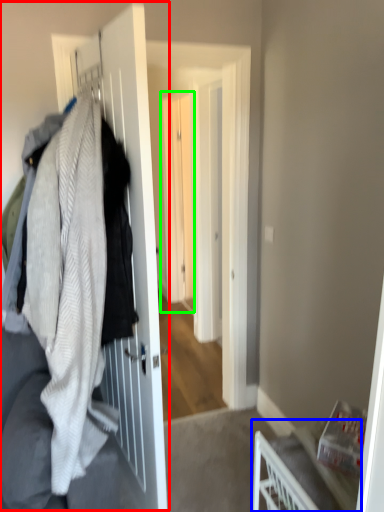
Question: Which is farther away from closet (highlighted by a red box)? furniture (highlighted by a blue box) or screen door (highlighted by a green box)?

Choices:
 (A) furniture
 (B) screen door

Answer: (B)